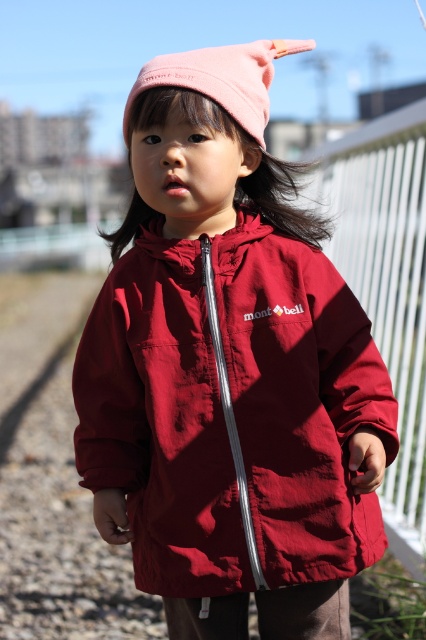
Can you confirm if burgundy fabric jacket at center is positioned to the left of pink fabric hat at upper center?

Indeed, burgundy fabric jacket at center is positioned on the left side of pink fabric hat at upper center.

Is point (216, 227) farther from viewer compared to point (203, 51)?

Yes, point (216, 227) is behind point (203, 51).

Between point (344, 592) and point (176, 86), which one is positioned in front?

Point (176, 86) is more forward.

Find the location of a particular element. burgundy fabric jacket at center is located at coordinates (230, 371).

Who is positioned more to the right, burgundy fabric jacket at center or white plastic fence at right?

white plastic fence at right is more to the right.

Which is behind, point (164, 340) or point (420, 211)?

The point (420, 211) is behind.

Who is more forward, (328, 356) or (394, 353)?

Point (328, 356)

The width and height of the screenshot is (426, 640). I want to click on burgundy fabric jacket at center, so click(x=230, y=371).

This screenshot has width=426, height=640. What do you see at coordinates (388, 300) in the screenshot? I see `white plastic fence at right` at bounding box center [388, 300].

Does point (419, 348) come in front of point (256, 134)?

No, it is behind (256, 134).

Between point (402, 385) and point (132, 90), which one is positioned behind?

Positioned behind is point (402, 385).

I want to click on white plastic fence at right, so click(388, 300).